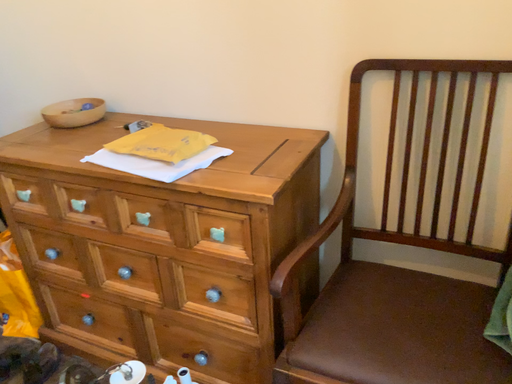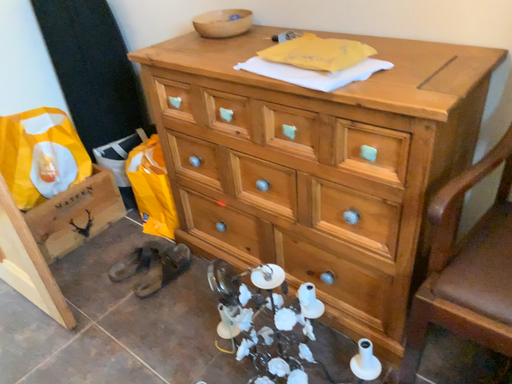
Question: Which way did the camera rotate in the video?

Choices:
 (A) rotated downward
 (B) rotated upward

Answer: (A)